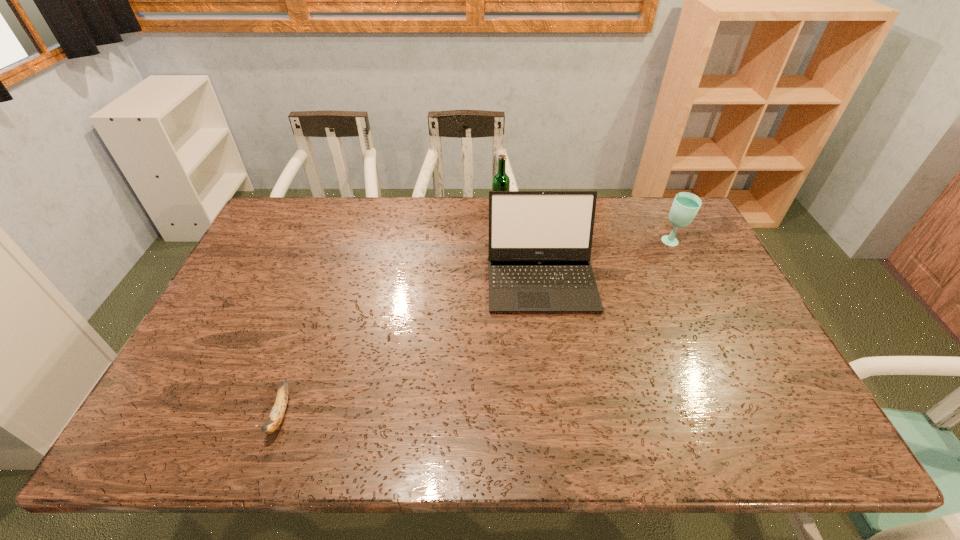
This screenshot has height=540, width=960. I want to click on free point between the leftmost object and the farthest object, so click(390, 314).

The height and width of the screenshot is (540, 960). What are the coordinates of `vacant point located between the beer bottle and the shortest object` in the screenshot? It's located at (390, 314).

At what (x,y) coordinates should I click in order to perform the action: click on free spot between the nearest object and the farthest object. Please return your answer as a coordinate pair (x, y). Looking at the image, I should click on (390, 314).

You are a GUI agent. You are given a task and a screenshot of the screen. Output one action in this format:
    pyautogui.click(x=<x>, y=<y>)
    Task: Click on the empty space that is in between the nearest object and the farthest object
    
    Given the screenshot: What is the action you would take?
    pyautogui.click(x=390, y=314)

At what (x,y) coordinates should I click in order to perform the action: click on free area in between the nearest object and the farthest object. Please return your answer as a coordinate pair (x, y). The height and width of the screenshot is (540, 960). Looking at the image, I should click on (390, 314).

In order to click on unoccupied area between the laptop and the leftmost object in this screenshot , I will do `click(411, 347)`.

Locate which object ranks second in proximity to the shortest object. Please provide its 2D coordinates. Your answer should be formatted as a tuple, i.e. [(x, y)], where the tuple contains the x and y coordinates of a point satisfying the conditions above.

[(501, 182)]

Identify which object is the second nearest to the farthest object. Please provide its 2D coordinates. Your answer should be formatted as a tuple, i.e. [(x, y)], where the tuple contains the x and y coordinates of a point satisfying the conditions above.

[(685, 206)]